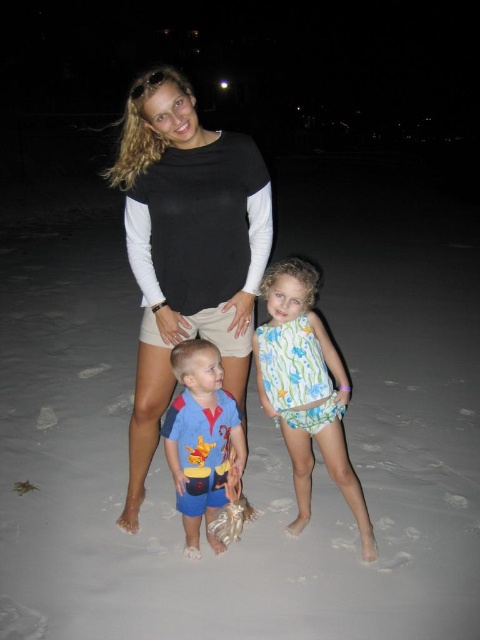
What is located at the coordinates point (187, 248)?

The black cotton shirt at center is located at point (187, 248).

You are a photographer trying to capture a clear shot of the two people wearing the floral print swimsuit at center and the blue cotton shirt at center. Which clothing item should you focus on first if you want to ensure both are in focus, considering their heights?

The floral print swimsuit at center is taller than the blue cotton shirt at center, so focusing on the taller floral print swimsuit at center first would help ensure both are in focus since it requires adjusting focus for the greater height difference.

You are a photographer trying to determine the layering of clothing in the image. Which clothing item, the black cotton shirt at center or the blue cotton shirt at center, appears closer to the camera?

The black cotton shirt at center appears closer to the camera because it is positioned above the blue cotton shirt at center, indicating it is layered on top.